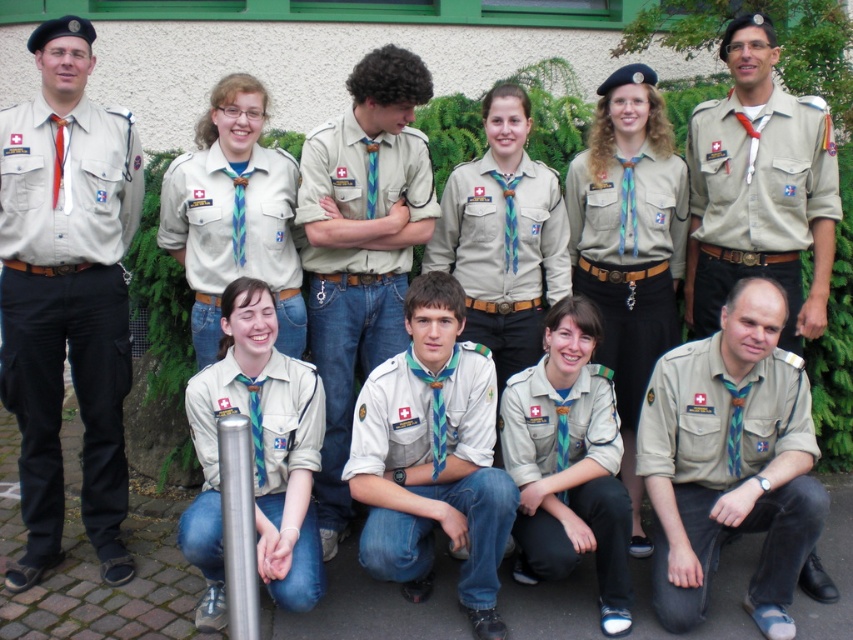
You are organizing a uniform inventory for the scout group and need to determine which uniform is more suitable for a child. Which uniform between the beige fabric uniform at lower right and the light beige uniform at center should be chosen?

The beige fabric uniform at lower right has a smaller size compared to the light beige uniform at center, so the beige fabric uniform at lower right is more suitable for a child.

You are a scout leader trying to identify the exact location of the beige fabric uniform at lower right in the group photo. According to the coordinates provided, where would you find it?

The beige fabric uniform at lower right is located at point [728,470].